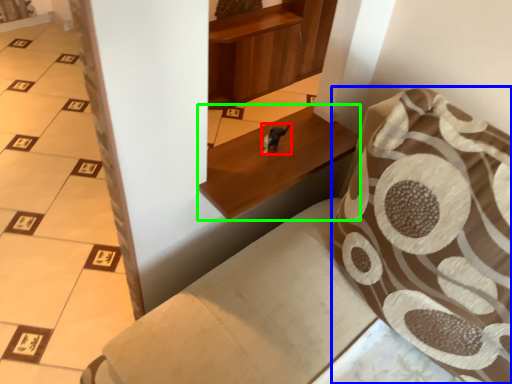
Question: Which object is the farthest from animal (highlighted by a red box)? Choose among these: throw pillow (highlighted by a blue box) or furniture (highlighted by a green box).

Choices:
 (A) throw pillow
 (B) furniture

Answer: (A)